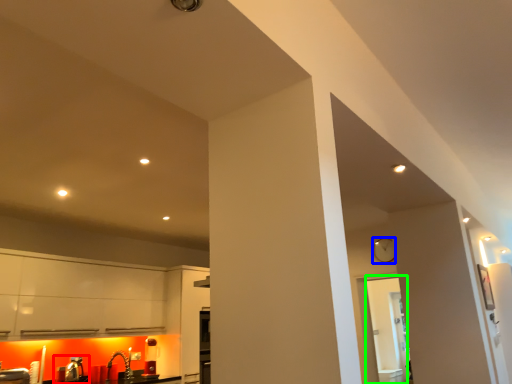
Question: Estimate the real-world distances between objects in this image. Which object is closer to sink (highlighted by a red box), clock (highlighted by a blue box) or glass door (highlighted by a green box)?

Choices:
 (A) clock
 (B) glass door

Answer: (A)